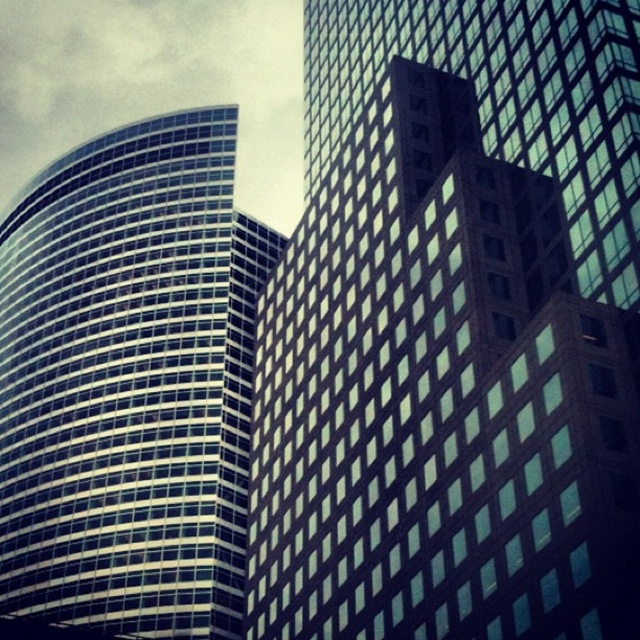
Question: Which point appears closest to the camera in this image?

Choices:
 (A) (257, 561)
 (B) (13, 602)

Answer: (A)

Question: In this image, where is glassy reflective skyscraper at center located relative to glassy reflective skyscraper at left?

Choices:
 (A) above
 (B) below

Answer: (A)

Question: Which point is closer to the camera?

Choices:
 (A) glassy reflective skyscraper at center
 (B) glassy reflective skyscraper at left

Answer: (A)

Question: Among these points, which one is farthest from the camera?

Choices:
 (A) (262, 358)
 (B) (188, 378)

Answer: (B)

Question: Does glassy reflective skyscraper at center lie behind glassy reflective skyscraper at left?

Choices:
 (A) yes
 (B) no

Answer: (B)

Question: Is glassy reflective skyscraper at center wider than glassy reflective skyscraper at left?

Choices:
 (A) yes
 (B) no

Answer: (B)